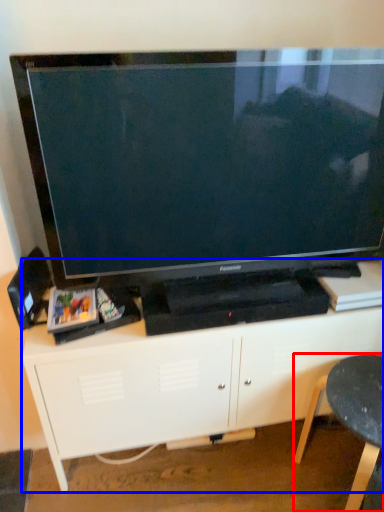
Question: Which of the following is the farthest to the observer, furniture (highlighted by a red box) or entertainment center (highlighted by a blue box)?

Choices:
 (A) furniture
 (B) entertainment center

Answer: (B)